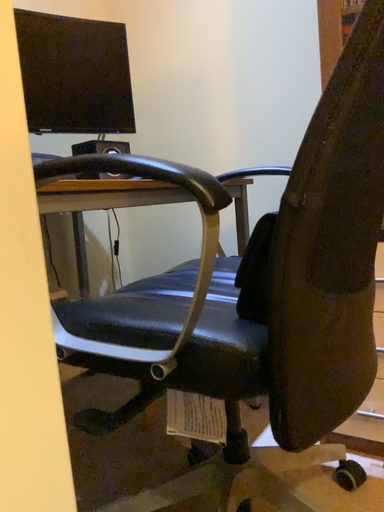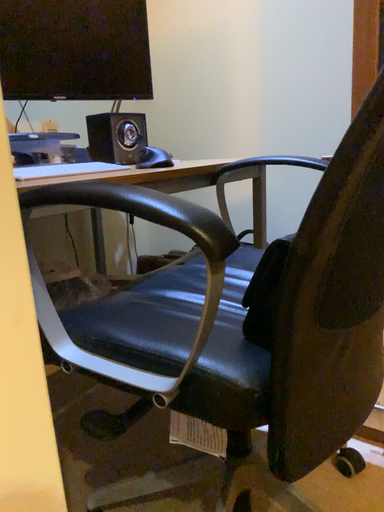
Question: Which way did the camera rotate in the video?

Choices:
 (A) rotated upward
 (B) rotated downward

Answer: (B)